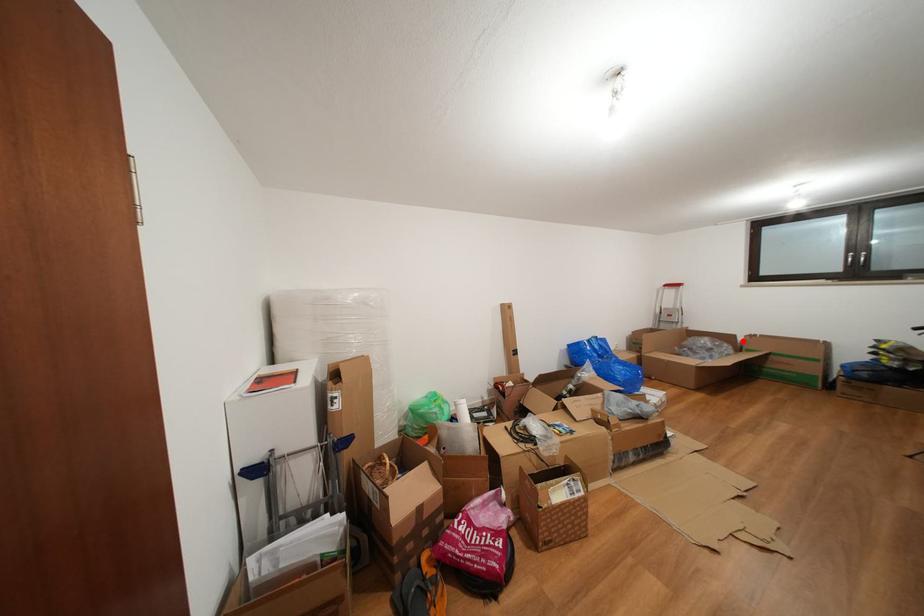
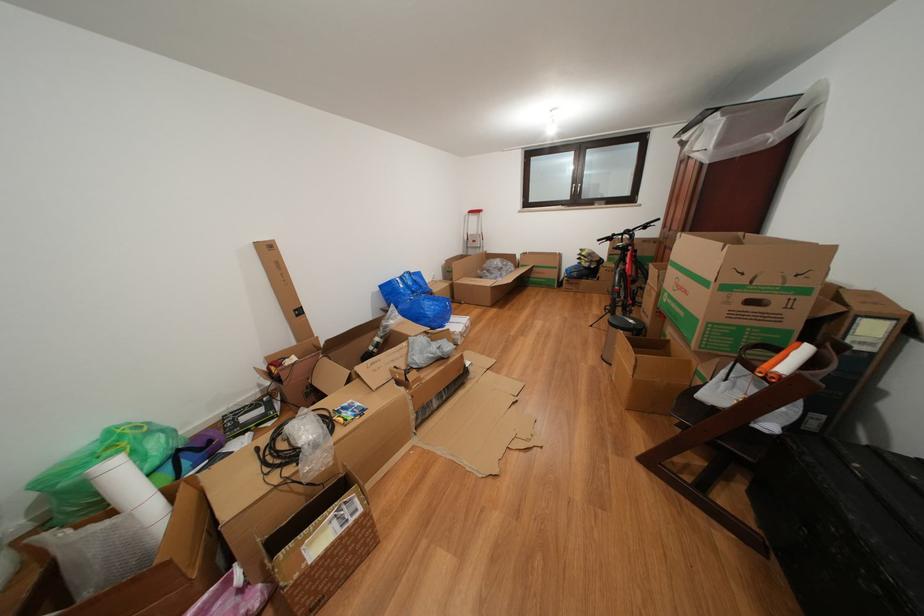
Question: I am providing you with two images of the same scene from different viewpoints. Given a red point in image1, look at the same physical point in image2. Is it:

Choices:
 (A) Closer to the viewpoint
 (B) Farther from the viewpoint

Answer: (A)